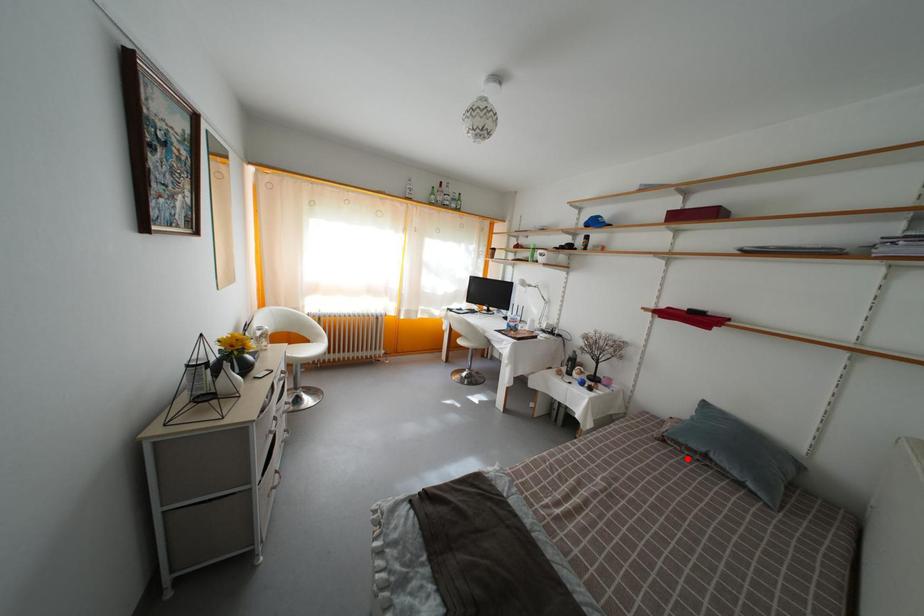
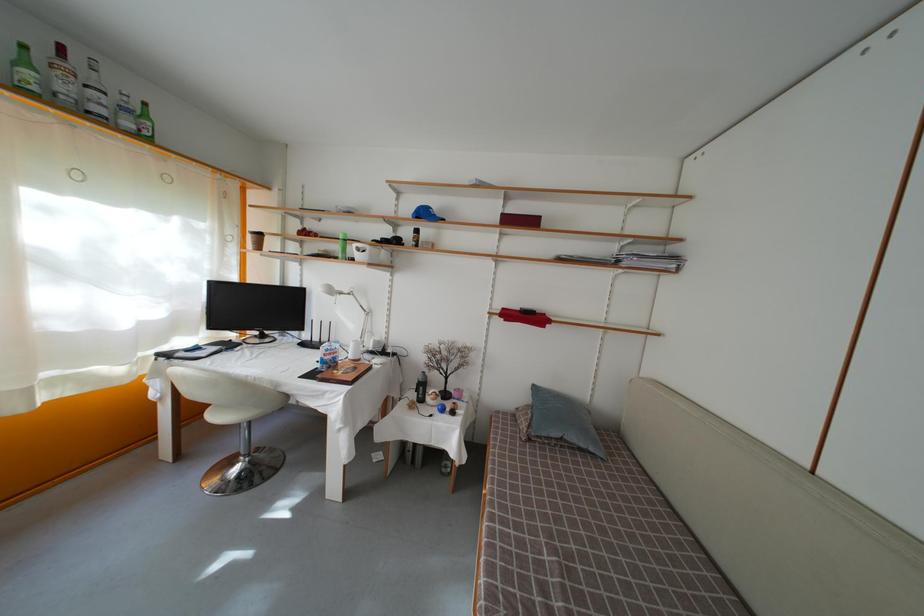
The point at the highlighted location is marked in the first image. Where is the corresponding point in the second image?

(550, 450)